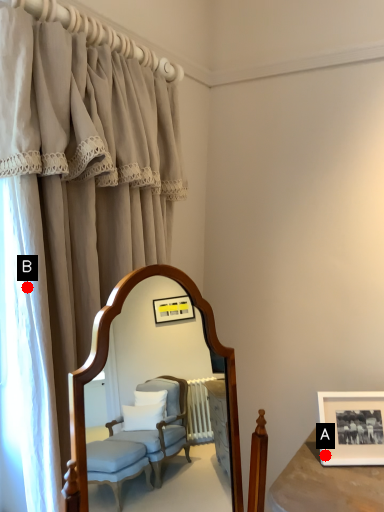
Question: Two points are circled on the image, labeled by A and B beside each circle. Which point appears closest to the camera in this image?

Choices:
 (A) A is closer
 (B) B is closer

Answer: (B)